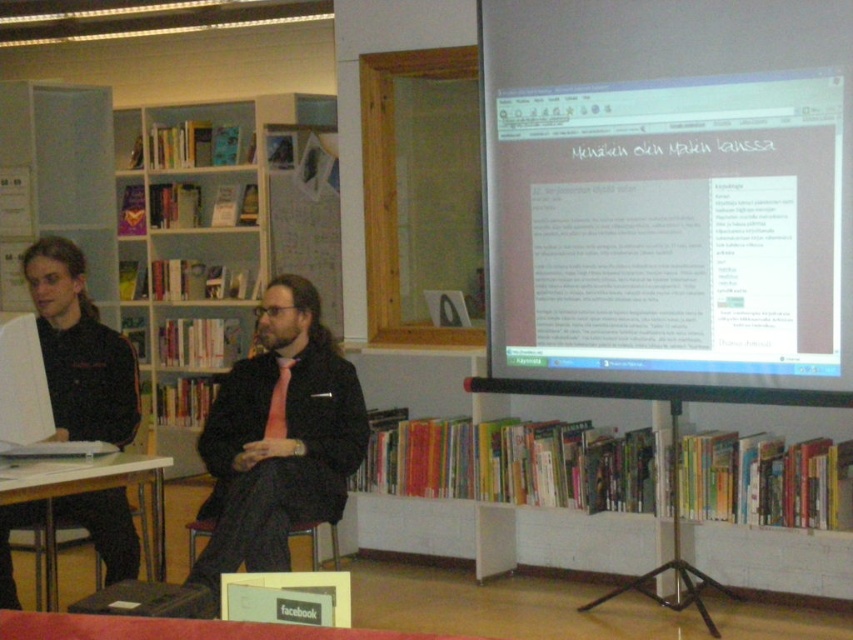
You are an interior designer planning to place a floor lamp next to the white wooden bookshelf at left and the matte black suit at center. Which object should the lamp be placed closer to if it needs to be positioned at the same height as the taller object?

The white wooden bookshelf at left is taller than the matte black suit at center. To position the floor lamp at the same height as the taller object, it should be placed closer to the white wooden bookshelf at left.

You are a presenter standing in front of the white glossy projector screen at upper right and the white plastic table at lower left. Which object is located to your right side?

The white glossy projector screen at upper right is located to your right side as it is positioned on the right side of the white plastic table at lower left.

You are organizing a presentation in the library. You need to place a 1.2 meter wide screen between the white wooden bookshelf at left and the matte black suit at center. Is there enough space?

The white wooden bookshelf at left is positioned on the left side of matte black suit at center. Since the bookshelf is to the left of the suit, there is space between them. However, the exact distance isn not provided, so we cannot confirm if the 1.2 meter screen will fit without knowing the actual spacing between the objects.